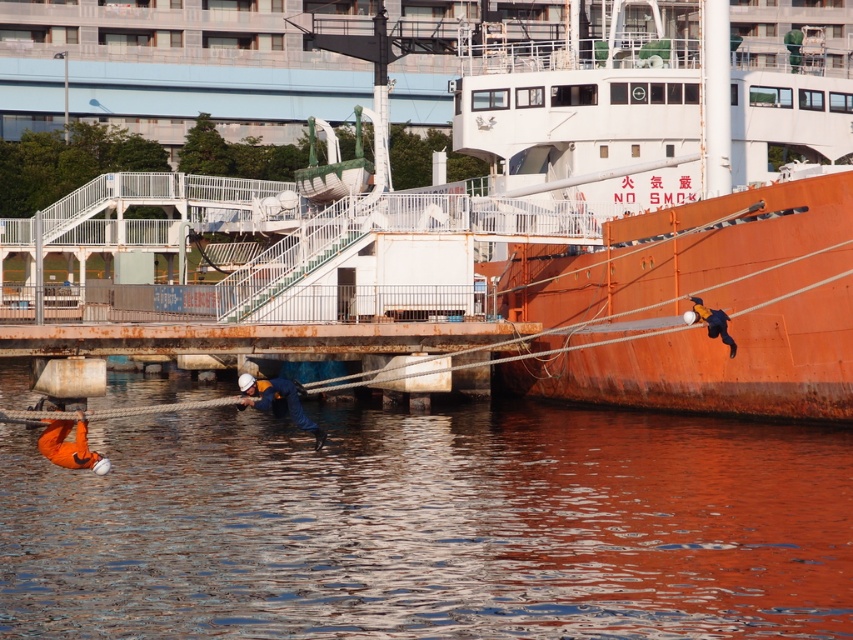
You are a photographer standing at the edge of the pier. You want to capture a photo where the smooth water at lower left and the blue fabric jacket at right are both visible. Which object should you focus on first to ensure both are in frame?

The smooth water at lower left is much taller than the blue fabric jacket at right, so focusing on the taller smooth water at lower left first will help ensure both are in frame.

What is the coordinate of the smooth water at lower left?

The smooth water at lower left is located at point (431, 525).

Based on the photo, you are a safety inspector observing the scene. You need to check the positions of the orange fabric helmet at lower center and the orange life vest at lower left. Which object is positioned more to the right?

The orange fabric helmet at lower center is positioned more to the right than the orange life vest at lower left.